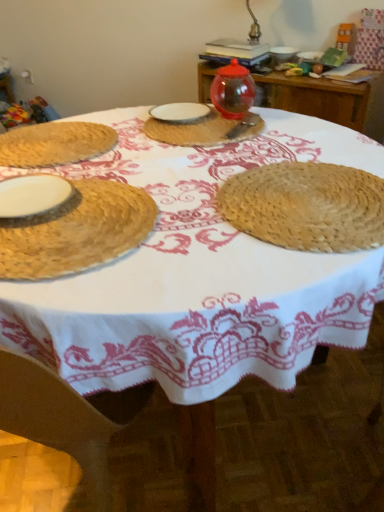
Find the location of a particular element. vacant area located to the right-hand side of matte wicker placemat at center is located at coordinates (316, 141).